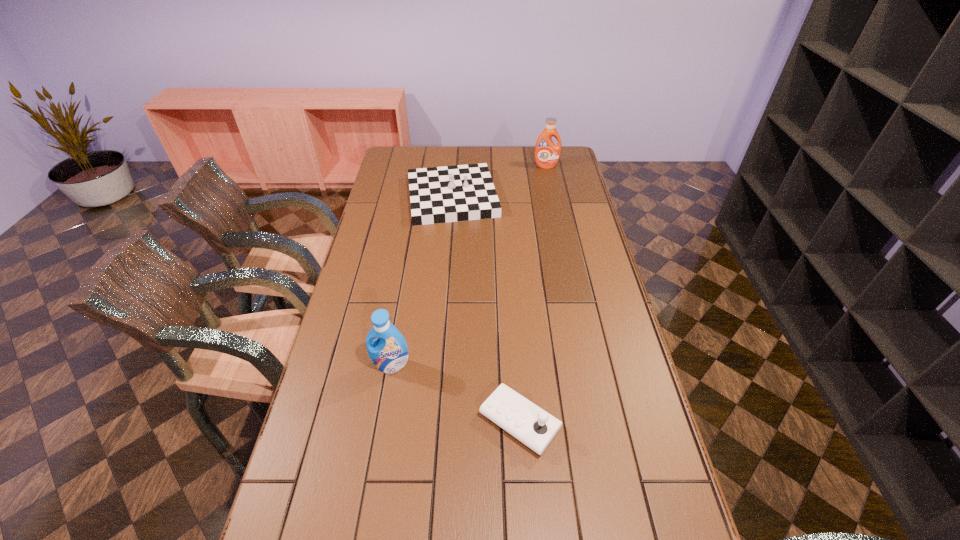
Locate an element on the screen. vacant area between the shortest object and the left detergent is located at coordinates (455, 393).

Locate an element on the screen. unoccupied position between the second farthest object and the third farthest object is located at coordinates (421, 281).

Locate an element on the screen. The width and height of the screenshot is (960, 540). free spot between the third nearest object and the nearer detergent is located at coordinates (421, 281).

At what (x,y) coordinates should I click in order to perform the action: click on vacant space in between the third nearest object and the third farthest object. Please return your answer as a coordinate pair (x, y). This screenshot has height=540, width=960. Looking at the image, I should click on (421, 281).

The width and height of the screenshot is (960, 540). In order to click on blank region between the checkerboard and the rightmost object in this screenshot , I will do `click(499, 181)`.

Where is `vacant area that lies between the third nearest object and the farthest object`? The height and width of the screenshot is (540, 960). vacant area that lies between the third nearest object and the farthest object is located at coordinates (499, 181).

This screenshot has width=960, height=540. I want to click on vacant area that lies between the nearest object and the rightmost object, so click(533, 294).

Where is `vacant space that is in between the farther detergent and the nearest object`? vacant space that is in between the farther detergent and the nearest object is located at coordinates (533, 294).

The image size is (960, 540). What are the coordinates of `vacant region between the farthest object and the second farthest object` in the screenshot? It's located at (499, 181).

Point out which object is positioned as the second nearest to the farther detergent. Please provide its 2D coordinates. Your answer should be formatted as a tuple, i.e. [(x, y)], where the tuple contains the x and y coordinates of a point satisfying the conditions above.

[(389, 353)]